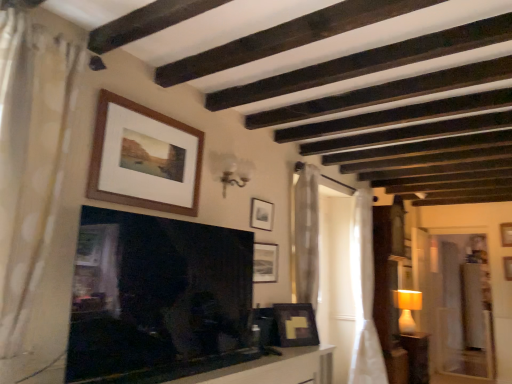
This screenshot has width=512, height=384. What are the coordinates of `empty space that is ontop of wooden frame at upper center, which appears as the fifth picture frame when viewed from the right (from a real-world perspective)` in the screenshot? It's located at [x=147, y=109].